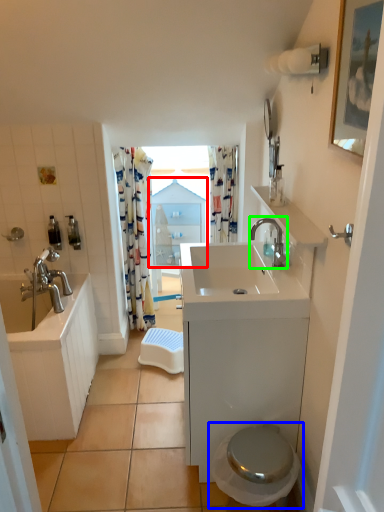
Question: Estimate the real-world distances between objects in this image. Which object is closer to medicine cabinet (highlighted by a red box), toilet (highlighted by a blue box) or tap (highlighted by a green box)?

Choices:
 (A) toilet
 (B) tap

Answer: (B)